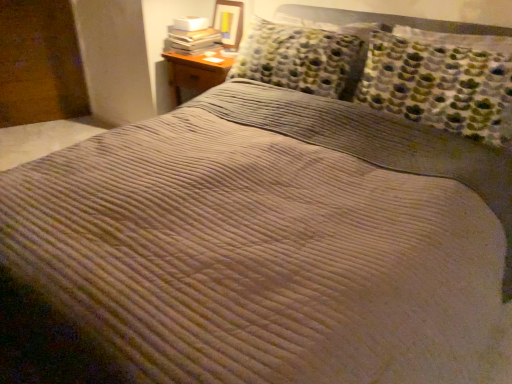
Describe the element at coordinates (192, 36) in the screenshot. This screenshot has width=512, height=384. I see `white paper stack at upper left` at that location.

What is the approximate height of white paper stack at upper left?

white paper stack at upper left is 5.80 inches tall.

This screenshot has height=384, width=512. In order to click on white paper stack at upper left in this screenshot , I will do `click(192, 36)`.

Describe the element at coordinates (229, 22) in the screenshot. I see `matte wooden picture frame at upper center` at that location.

This screenshot has height=384, width=512. I want to click on matte wooden picture frame at upper center, so click(229, 22).

Measure the distance between point (219, 9) and camera.

The depth of point (219, 9) is 2.93 meters.

Identify the location of white paper stack at upper left. (192, 36).

Consider the image. Is white paper stack at upper left at the right side of matte wooden picture frame at upper center?

In fact, white paper stack at upper left is to the left of matte wooden picture frame at upper center.

Is the position of white paper stack at upper left less distant than that of matte wooden picture frame at upper center?

Yes, it is in front of matte wooden picture frame at upper center.

Which is farther from the camera, (181,27) or (222,20)?

The point (222,20) is behind.

From the image's perspective, would you say white paper stack at upper left is positioned over matte wooden picture frame at upper center?

No, from the image's perspective, white paper stack at upper left is not over matte wooden picture frame at upper center.

From a real-world perspective, relative to matte wooden picture frame at upper center, is white paper stack at upper left vertically above or below?

Clearly, from a real-world perspective, white paper stack at upper left is below matte wooden picture frame at upper center.

Does white paper stack at upper left have a greater width compared to matte wooden picture frame at upper center?

Correct, the width of white paper stack at upper left exceeds that of matte wooden picture frame at upper center.

Which of these two, white paper stack at upper left or matte wooden picture frame at upper center, stands taller?

matte wooden picture frame at upper center.

Is white paper stack at upper left smaller than matte wooden picture frame at upper center?

Incorrect, white paper stack at upper left is not smaller in size than matte wooden picture frame at upper center.

Is white paper stack at upper left positioned beyond the bounds of matte wooden picture frame at upper center?

Yes, white paper stack at upper left is not within matte wooden picture frame at upper center.

Does white paper stack at upper left touch matte wooden picture frame at upper center?

white paper stack at upper left and matte wooden picture frame at upper center are not in contact.

Is white paper stack at upper left facing towards matte wooden picture frame at upper center?

No, white paper stack at upper left is not aimed at matte wooden picture frame at upper center.

How far apart are white paper stack at upper left and matte wooden picture frame at upper center?

white paper stack at upper left is 17.79 centimeters away from matte wooden picture frame at upper center.

Image resolution: width=512 pixels, height=384 pixels. In the image, there is a white paper stack at upper left. What are the coordinates of `picture frame above it (from the image's perspective)` in the screenshot? It's located at (229, 22).

Is matte wooden picture frame at upper center at the right side of white paper stack at upper left?

Correct, you'll find matte wooden picture frame at upper center to the right of white paper stack at upper left.

Is the position of matte wooden picture frame at upper center less distant than that of white paper stack at upper left?

No, it is behind white paper stack at upper left.

Which point is more forward, (x=215, y=5) or (x=185, y=42)?

The point (x=185, y=42) is in front.

From the image's perspective, is matte wooden picture frame at upper center positioned above or below white paper stack at upper left?

matte wooden picture frame at upper center is above white paper stack at upper left.

From a real-world perspective, which is physically above, matte wooden picture frame at upper center or white paper stack at upper left?

matte wooden picture frame at upper center is physically above.

Is matte wooden picture frame at upper center wider or thinner than white paper stack at upper left?

In the image, matte wooden picture frame at upper center appears to be more narrow than white paper stack at upper left.

Is matte wooden picture frame at upper center taller than white paper stack at upper left?

Yes, matte wooden picture frame at upper center is taller than white paper stack at upper left.

Which of these two, matte wooden picture frame at upper center or white paper stack at upper left, is smaller?

With smaller size is matte wooden picture frame at upper center.

Is matte wooden picture frame at upper center not within white paper stack at upper left?

Yes, matte wooden picture frame at upper center is located beyond the bounds of white paper stack at upper left.

Is matte wooden picture frame at upper center not close to white paper stack at upper left?

No, matte wooden picture frame at upper center is not far from white paper stack at upper left.

Is matte wooden picture frame at upper center facing away from white paper stack at upper left?

No, matte wooden picture frame at upper center is not facing away from white paper stack at upper left.

What's the angular difference between matte wooden picture frame at upper center and white paper stack at upper left's facing directions?

The angle between the facing direction of matte wooden picture frame at upper center and the facing direction of white paper stack at upper left is 1.83 degrees.

How much distance is there between matte wooden picture frame at upper center and white paper stack at upper left?

The distance of matte wooden picture frame at upper center from white paper stack at upper left is 7.00 inches.

Find the location of a particular element. This screenshot has height=384, width=512. book in front of the matte wooden picture frame at upper center is located at coordinates 192,36.

At what (x,y) coordinates should I click in order to perform the action: click on picture frame above the white paper stack at upper left (from a real-world perspective). Please return your answer as a coordinate pair (x, y). The width and height of the screenshot is (512, 384). Looking at the image, I should click on (229, 22).

Locate an element on the screen. The width and height of the screenshot is (512, 384). book that is below the matte wooden picture frame at upper center (from the image's perspective) is located at coordinates (192, 36).